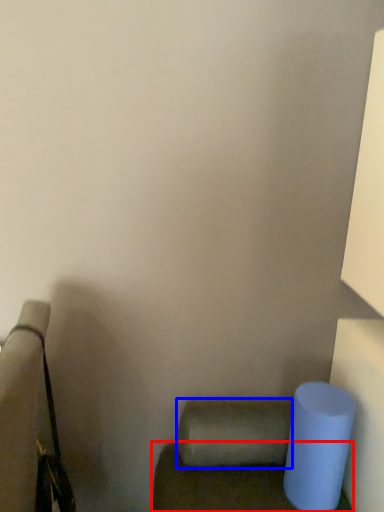
Question: Which object appears farthest to the camera in this image, furniture (highlighted by a red box) or toilet paper (highlighted by a blue box)?

Choices:
 (A) furniture
 (B) toilet paper

Answer: (B)